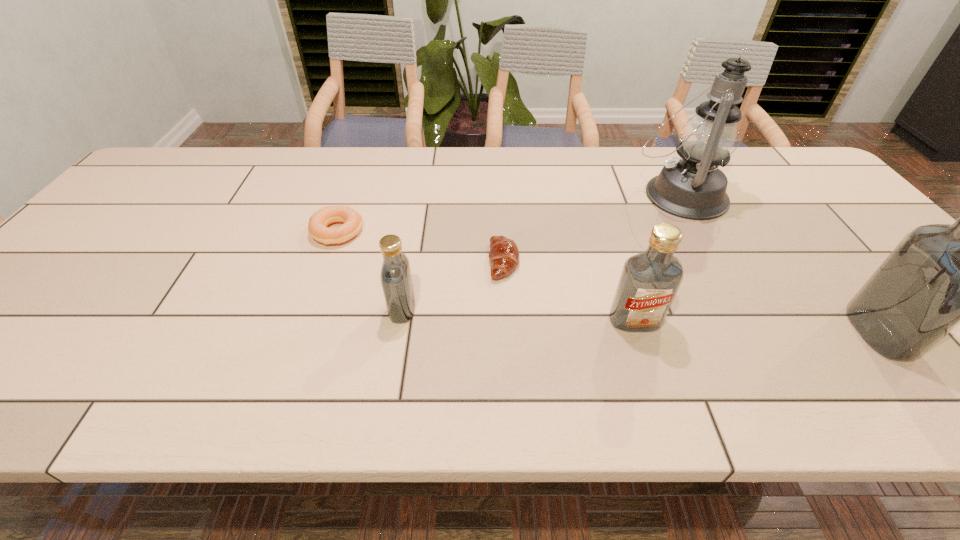
At what (x,y) coordinates should I click in order to perform the action: click on vacant space at the near edge of the desktop. Please return your answer as a coordinate pair (x, y). The image size is (960, 540). Looking at the image, I should click on (861, 342).

At what (x,y) coordinates should I click in order to perform the action: click on vacant space at the left edge. Please return your answer as a coordinate pair (x, y). The height and width of the screenshot is (540, 960). Looking at the image, I should click on (107, 273).

Identify the location of vacant area at the right edge of the desktop. (817, 208).

In the image, there is a desktop. At what (x,y) coordinates should I click in order to perform the action: click on vacant space at the far right corner. Please return your answer as a coordinate pair (x, y). Looking at the image, I should click on (775, 150).

Where is `free space between the oil lamp and the third object from left to right`? This screenshot has height=540, width=960. free space between the oil lamp and the third object from left to right is located at coordinates (591, 228).

What are the coordinates of `free spot between the fifth object from right to left and the third object from left to right` in the screenshot? It's located at (453, 285).

You are a GUI agent. You are given a task and a screenshot of the screen. Output one action in this format:
    pyautogui.click(x=<x>, y=<y>)
    Task: Click on the vacant area between the rightmost object and the oil lamp
    The image size is (960, 540).
    Given the screenshot: What is the action you would take?
    pyautogui.click(x=779, y=264)

This screenshot has width=960, height=540. Identify the location of vacant area that lies between the crescent roll and the oil lamp. (591, 228).

Identify the location of vacant point located between the leftmost vodka and the bagel. (370, 271).

What are the coordinates of `free point between the third object from right to left and the rightmost object` in the screenshot? It's located at (756, 326).